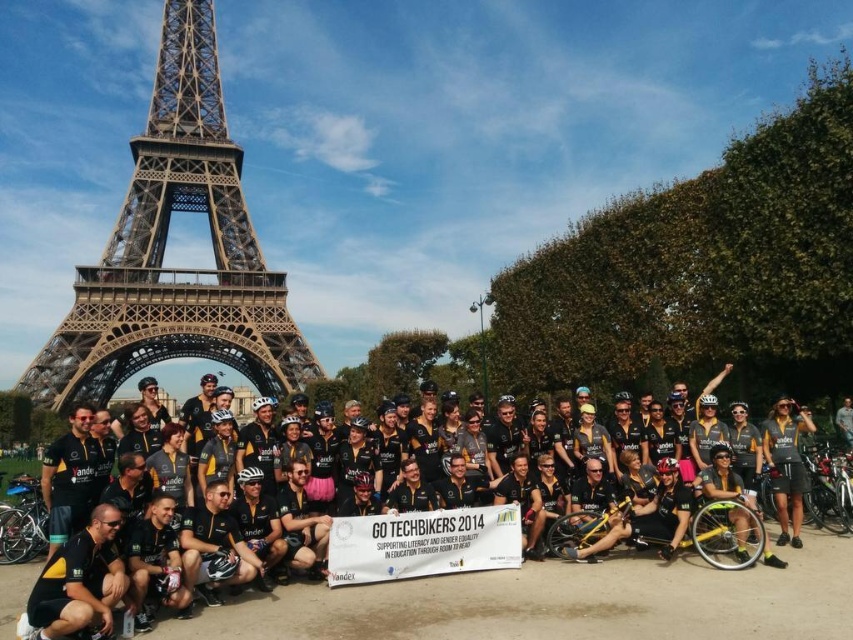
You are a photographer who wants to capture the metallic brown eiffel tower at center in the background of your photo. According to the coordinates provided, where should you position the tower in your camera frame?

The metallic brown eiffel tower at center is positioned at coordinates point (164,248), so you should align the tower at that point in your camera frame to capture it in the background.

You are a photographer trying to capture a photo of the metallic brown eiffel tower at center and the black matte jersey at center. Based on their sizes, which object would appear larger in the photo?

The metallic brown eiffel tower at center would appear much larger in the photo since it is much taller than the black matte jersey at center.

You are a photographer standing at the base of the metallic brown eiffel tower at center. You want to take a photo of the cyclists and the tower. If your camera has a maximum zoom range of 100 meters, will you be able to capture the cyclists clearly in the photo?

The distance between the metallic brown eiffel tower at center and the camera is 105.03 meters. Since the camera can only zoom up to 100 meters, it will not be sufficient to capture the cyclists clearly at this distance.